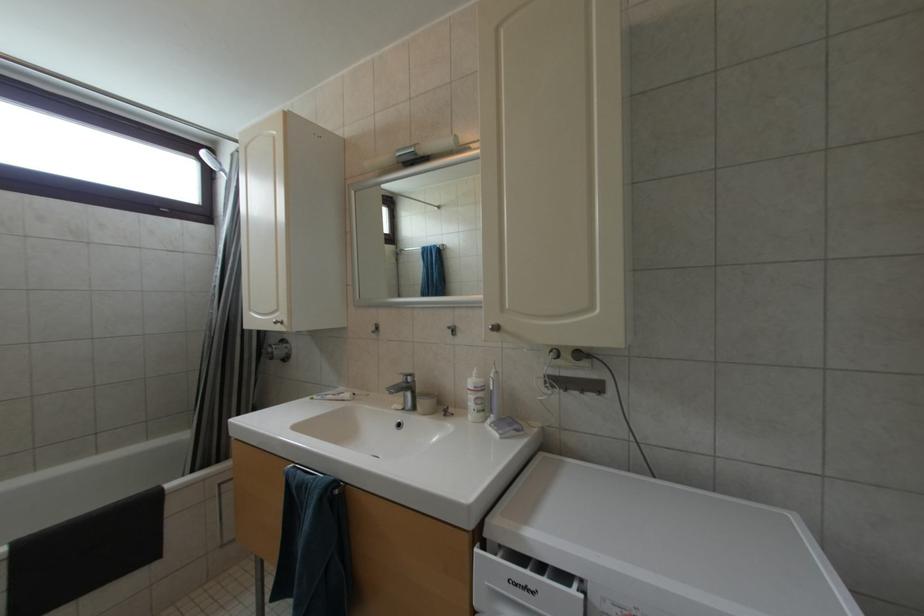
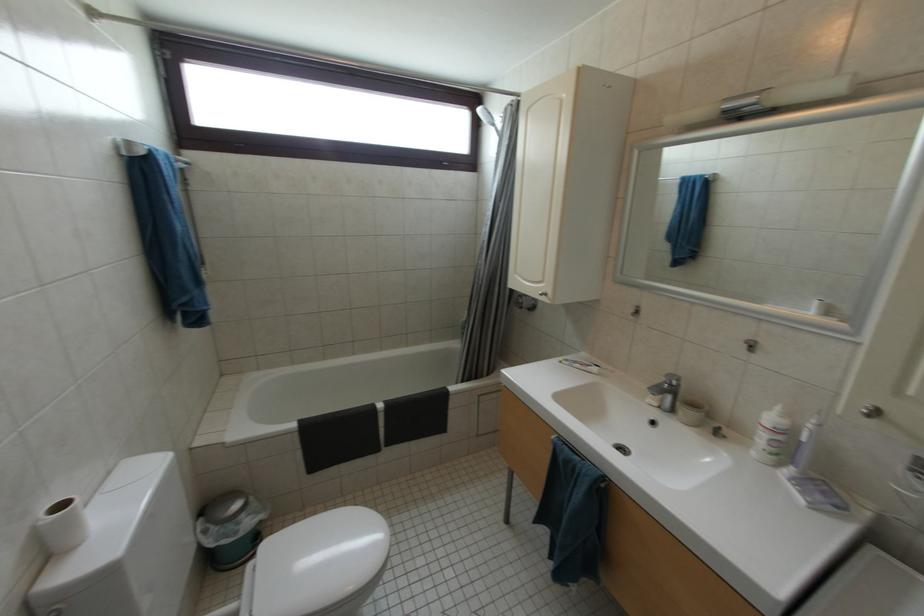
The images are taken continuously from a first-person perspective. In which direction is your viewpoint rotating?

The camera's rotation is toward left-down.